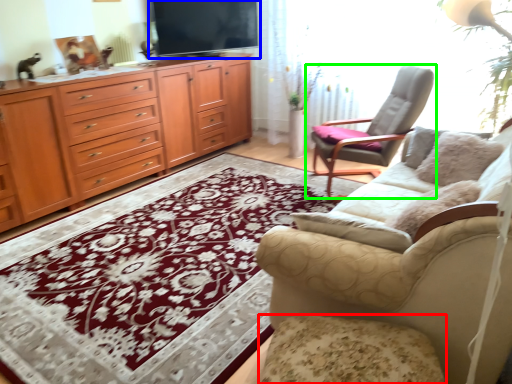
Question: Estimate the real-world distances between objects in this image. Which object is farther from footrest (highlighted by a red box), television (highlighted by a blue box) or chair (highlighted by a green box)?

Choices:
 (A) television
 (B) chair

Answer: (A)